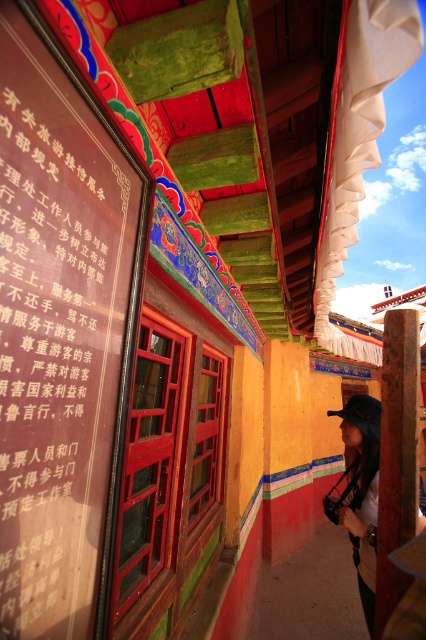
Between brown wooden post at center and matte black hat at lower right, which one has more height?

With more height is matte black hat at lower right.

Does point (411, 320) come behind point (359, 561)?

No, (411, 320) is in front of (359, 561).

Does point (405, 420) lie in front of point (365, 416)?

That is True.

Where is `brown wooden post at center`? The height and width of the screenshot is (640, 426). brown wooden post at center is located at coordinates (397, 452).

How distant is matte black signboard at upper left from brown wooden post at center?

matte black signboard at upper left and brown wooden post at center are 3.95 feet apart from each other.

Is matte black signboard at upper left taller than brown wooden post at center?

In fact, matte black signboard at upper left may be shorter than brown wooden post at center.

Is point (31, 394) farther from camera compared to point (397, 490)?

No, (31, 394) is in front of (397, 490).

The height and width of the screenshot is (640, 426). What are the coordinates of `matte black signboard at upper left` in the screenshot? It's located at 62,332.

Does matte black signboard at upper left appear over matte black hat at lower right?

Yes.

The height and width of the screenshot is (640, 426). Describe the element at coordinates (62, 332) in the screenshot. I see `matte black signboard at upper left` at that location.

Is point (20, 611) positioned before point (363, 442)?

Yes, point (20, 611) is in front of point (363, 442).

Locate an element on the screen. This screenshot has height=640, width=426. matte black signboard at upper left is located at coordinates (62, 332).